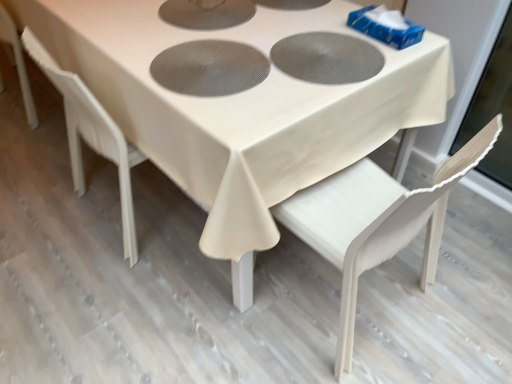
Where is `blank area beneath white matte chair at lower right, the 1th chair from the right (from a real-world perspective)`? blank area beneath white matte chair at lower right, the 1th chair from the right (from a real-world perspective) is located at coordinates (338, 301).